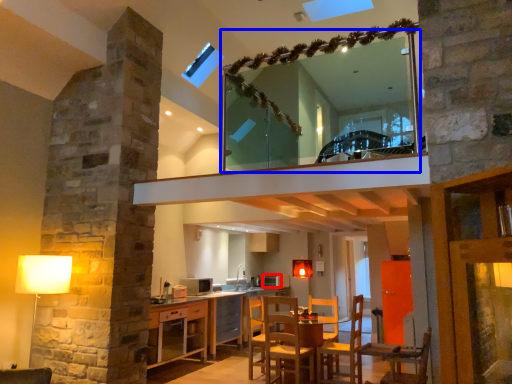
Question: Which of the following is the closest to the observer, appliance (highlighted by a red box) or mirror (highlighted by a blue box)?

Choices:
 (A) appliance
 (B) mirror

Answer: (B)